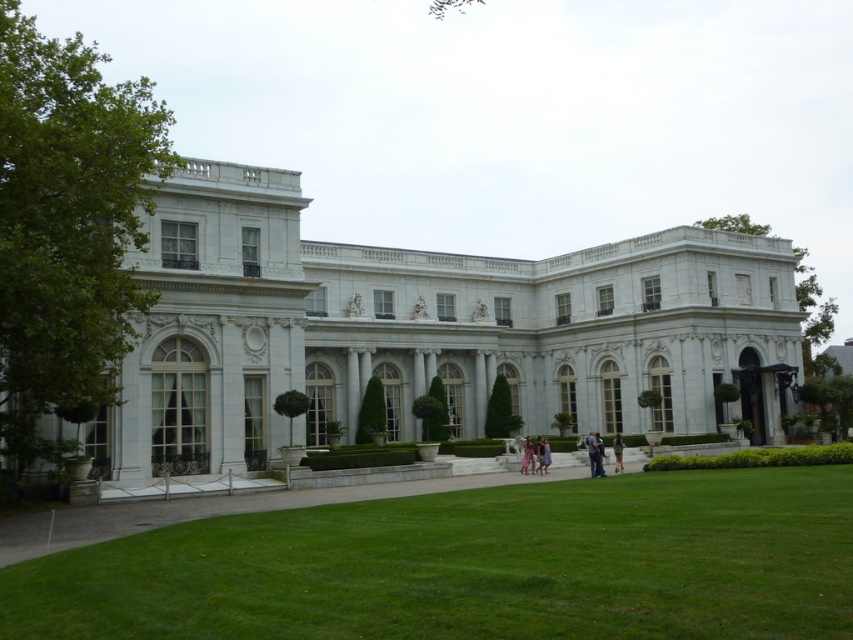
Question: Can you confirm if white marble mansion at center is thinner than green grass at center?

Choices:
 (A) yes
 (B) no

Answer: (B)

Question: Does white marble mansion at center appear on the left side of green grass at center?

Choices:
 (A) no
 (B) yes

Answer: (B)

Question: Which of the following is the farthest from the observer?

Choices:
 (A) white marble mansion at center
 (B) green grass at center

Answer: (A)

Question: Can you confirm if white marble mansion at center is wider than green grass at center?

Choices:
 (A) yes
 (B) no

Answer: (A)